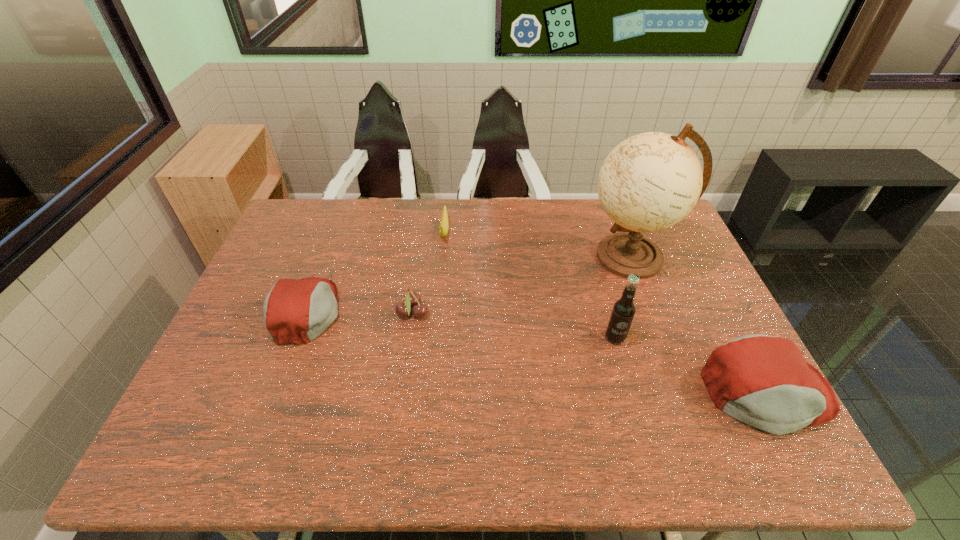
Find the location of a particular element. Image resolution: width=960 pixels, height=540 pixels. cap that is at the right edge is located at coordinates (763, 381).

Where is `globe that is at the right edge`? The width and height of the screenshot is (960, 540). globe that is at the right edge is located at coordinates tap(651, 181).

Find the location of `object that is positioned at the far right corner`. object that is positioned at the far right corner is located at coordinates (651, 181).

The width and height of the screenshot is (960, 540). In order to click on object that is positioned at the near right corner in this screenshot , I will do `click(763, 381)`.

I want to click on vacant space at the far edge of the desktop, so click(x=519, y=229).

Image resolution: width=960 pixels, height=540 pixels. In the image, there is a desktop. What are the coordinates of `vacant space at the near edge` in the screenshot? It's located at (394, 397).

You are a GUI agent. You are given a task and a screenshot of the screen. Output one action in this format:
    pyautogui.click(x=<x>, y=<y>)
    Task: Click on the free space at the left edge of the desktop
    This screenshot has width=960, height=540.
    Given the screenshot: What is the action you would take?
    pyautogui.click(x=272, y=350)

The image size is (960, 540). In the image, there is a desktop. Find the location of `vacant space at the right edge`. vacant space at the right edge is located at coordinates (661, 280).

Locate an element on the screen. The height and width of the screenshot is (540, 960). free spot at the near left corner of the desktop is located at coordinates (257, 388).

Locate an element on the screen. Image resolution: width=960 pixels, height=540 pixels. free spot between the left cap and the taller cap is located at coordinates (537, 352).